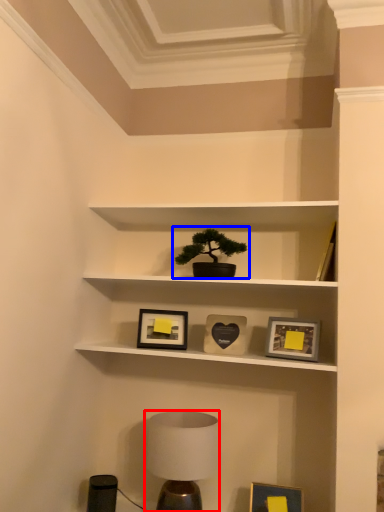
Question: Which of the following is the closest to the observer, table lamp (highlighted by a red box) or houseplant (highlighted by a blue box)?

Choices:
 (A) table lamp
 (B) houseplant

Answer: (A)